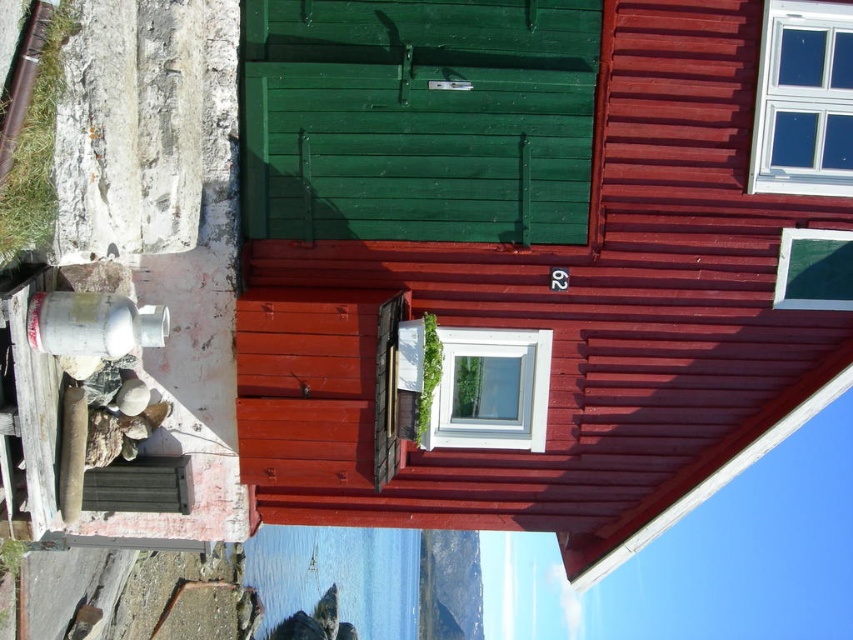
Is green wooden door at center bigger than white plastic window at center?

Indeed, green wooden door at center has a larger size compared to white plastic window at center.

Between point (361, 45) and point (469, 353), which one is positioned in front?

Point (361, 45)

Which is behind, point (554, 236) or point (517, 376)?

The point (517, 376) is behind.

You are a GUI agent. You are given a task and a screenshot of the screen. Output one action in this format:
    pyautogui.click(x=<x>, y=<y>)
    Task: Click on the green wooden door at center
    This screenshot has height=640, width=853.
    Given the screenshot: What is the action you would take?
    pyautogui.click(x=418, y=118)

Is point (753, 134) closer to viewer compared to point (838, 275)?

Yes.

Between clear glass window at upper right and green matte window at upper center, which one appears on the right side from the viewer's perspective?

Positioned to the right is green matte window at upper center.

Is point (793, 67) farther from viewer compared to point (808, 305)?

No, (793, 67) is closer to viewer.

In order to click on clear glass window at upper right in this screenshot , I will do `click(804, 100)`.

Measure the distance between clear glass window at upper right and white plastic window at center.

The distance of clear glass window at upper right from white plastic window at center is 9.78 feet.

Is point (759, 93) positioned behind point (543, 419)?

No.

Who is more forward, (821, 129) or (463, 403)?

Positioned in front is point (821, 129).

Locate an element on the screen. This screenshot has width=853, height=640. clear glass window at upper right is located at coordinates (804, 100).